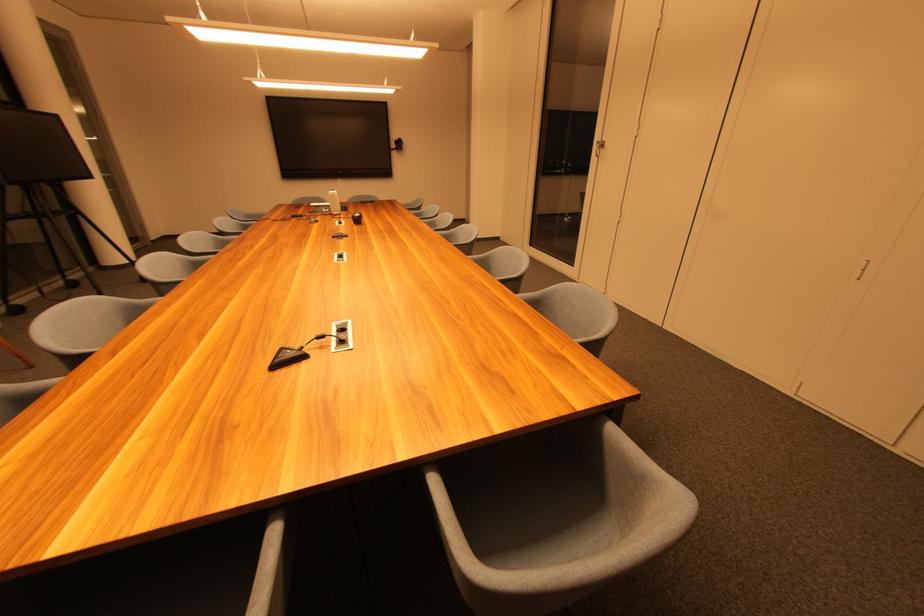
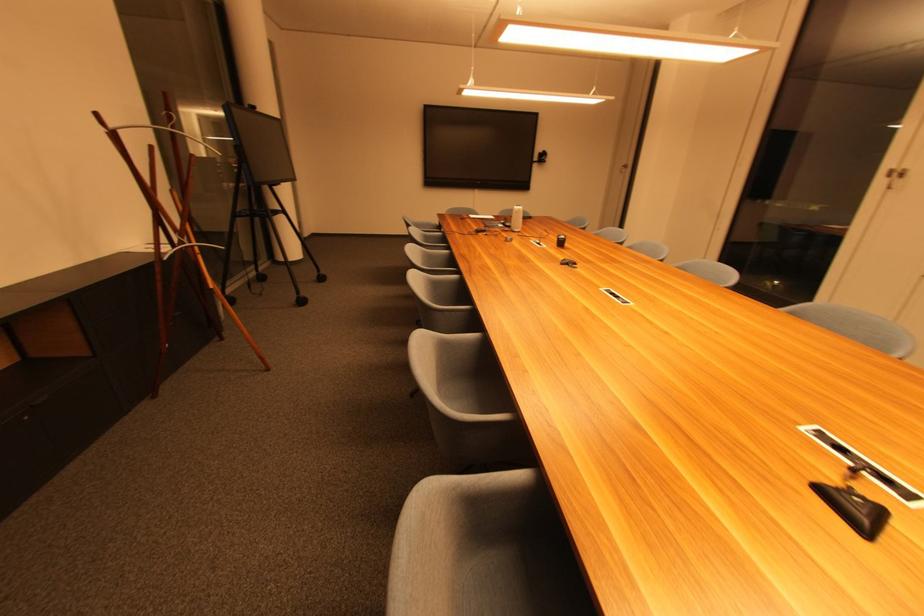
In the second image, find the point that corresponds to point (604, 142) in the first image.

(901, 169)